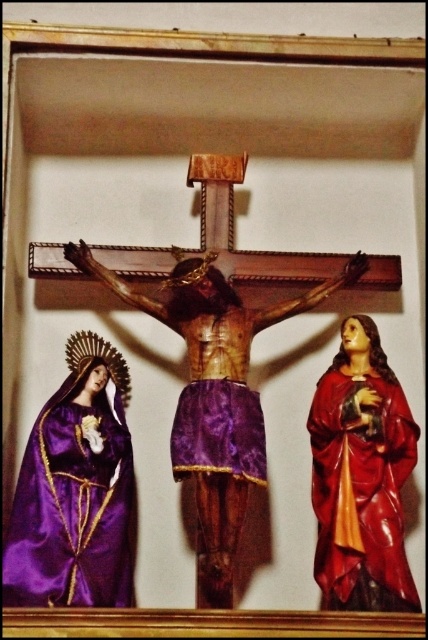
Can you confirm if velvet purple robe at left is positioned above velvet purple robe at center?

No, velvet purple robe at left is not above velvet purple robe at center.

Between velvet purple robe at left and velvet purple robe at center, which one is positioned lower?

velvet purple robe at left

Where is `velvet purple robe at left`? velvet purple robe at left is located at coordinates (71, 508).

Between velvet purple robe at left and shiny red robe at right, which one has more height?

Standing taller between the two is shiny red robe at right.

Find the location of a particular element. The width and height of the screenshot is (428, 640). velvet purple robe at left is located at coordinates (71, 508).

Is shiny red robe at right positioned before velvet purple robe at center?

Yes.

Which is behind, point (366, 529) or point (243, 428)?

Point (243, 428)

The image size is (428, 640). Find the location of `shiny red robe at right`. shiny red robe at right is located at coordinates (360, 493).